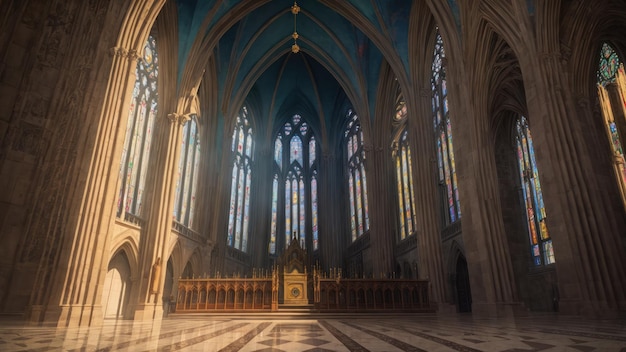
Where is `stain glass`? This screenshot has height=352, width=626. stain glass is located at coordinates (295, 196), (364, 187), (240, 184), (448, 178), (402, 175), (541, 191), (183, 165), (135, 166).